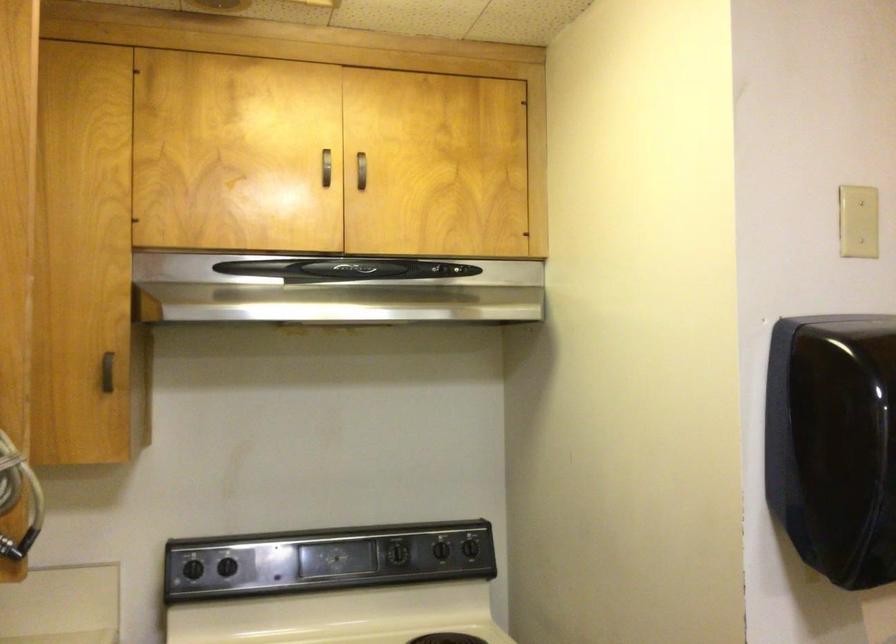
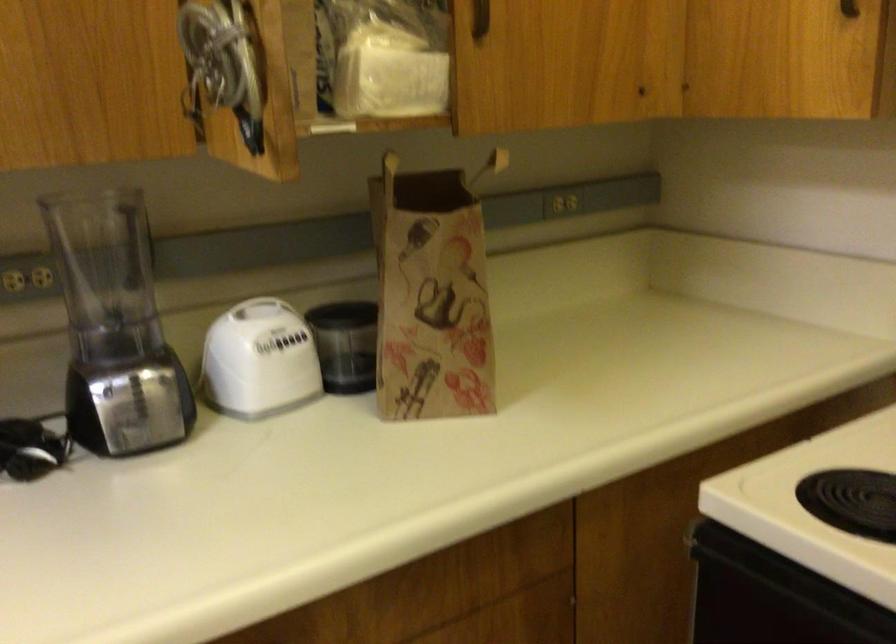
Find the pixel in the second image that matches pixel 108 398 in the first image.

(849, 8)